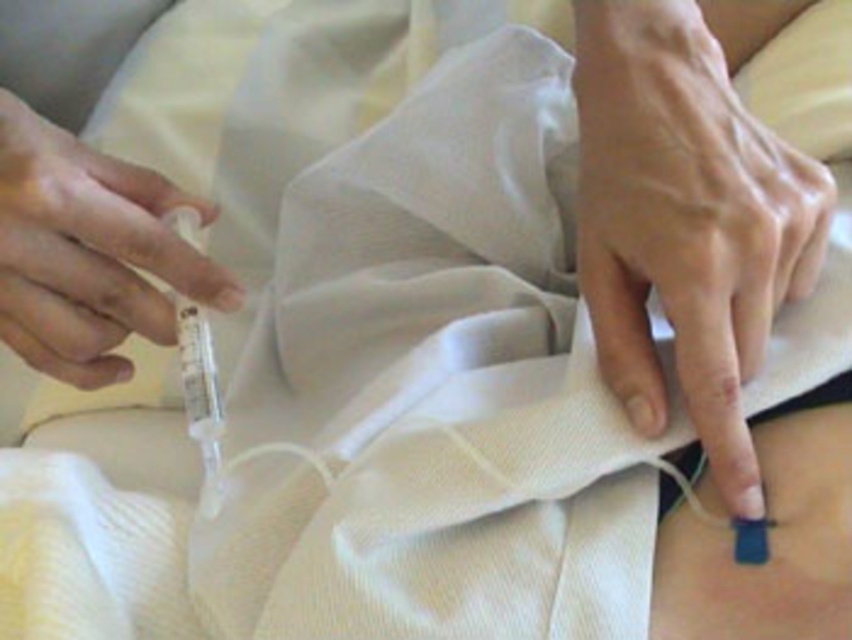
Which is above, smooth skin at lower right or blue matte sensor at lower right?

Positioned higher is smooth skin at lower right.

Can you confirm if smooth skin at lower right is positioned below blue matte sensor at lower right?

No, smooth skin at lower right is not below blue matte sensor at lower right.

Does point (764, 259) come farther from viewer compared to point (695, 609)?

No, (764, 259) is in front of (695, 609).

This screenshot has height=640, width=852. Find the location of `smooth skin at lower right`. smooth skin at lower right is located at coordinates (688, 212).

Which is behind, point (665, 81) or point (0, 205)?

The point (0, 205) is more distant.

At what (x,y) coordinates should I click in order to perform the action: click on smooth skin at lower right. Please return your answer as a coordinate pair (x, y). Looking at the image, I should click on (688, 212).

Does transparent plastic syringe at left have a larger size compared to blue matte sensor at lower right?

Yes.

Is transparent plastic syringe at left to the left of blue matte sensor at lower right from the viewer's perspective?

Yes, transparent plastic syringe at left is to the left of blue matte sensor at lower right.

Does point (101, 296) come farther from viewer compared to point (824, 529)?

That is True.

The image size is (852, 640). I want to click on transparent plastic syringe at left, so click(88, 252).